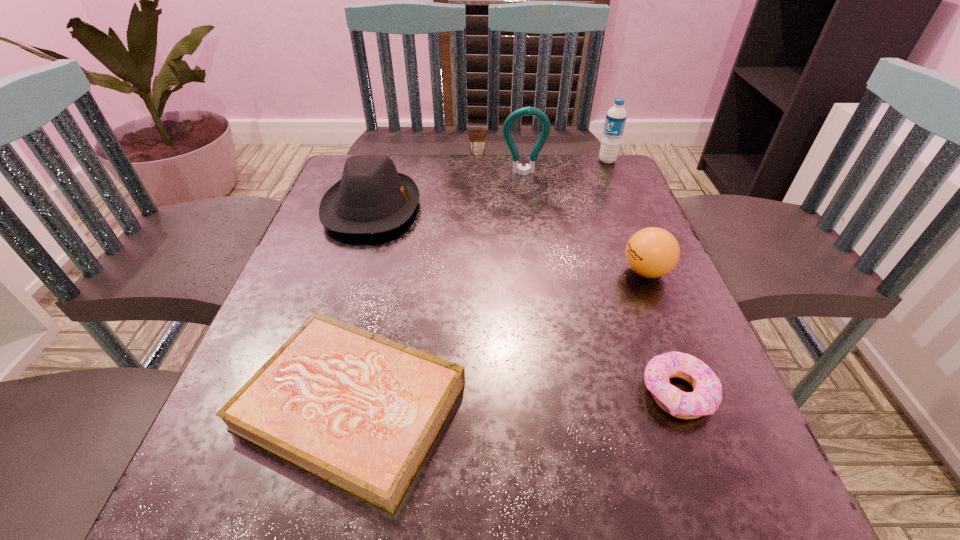
The height and width of the screenshot is (540, 960). I want to click on bottle opener, so click(517, 168).

Where is `the second farthest object`? The image size is (960, 540). the second farthest object is located at coordinates (517, 168).

At what (x,y) coordinates should I click in order to perform the action: click on the farthest object. Please return your answer as a coordinate pair (x, y). The width and height of the screenshot is (960, 540). Looking at the image, I should click on (616, 116).

The image size is (960, 540). I want to click on the third farthest object, so click(372, 197).

This screenshot has height=540, width=960. Identify the location of ping-pong ball. [652, 252].

Locate an element on the screen. hardback book is located at coordinates (359, 410).

This screenshot has width=960, height=540. Identify the location of doughnut. (x=707, y=391).

At what (x,y) coordinates should I click in order to perform the action: click on free space located at the jaws of the fifth nearest object. Please return your answer as a coordinate pair (x, y). This screenshot has height=540, width=960. Looking at the image, I should click on (538, 272).

Find the location of a particular element. This screenshot has width=960, height=540. vacant region located 0.390m on the label of the farthest object is located at coordinates (459, 160).

I want to click on vacant space located 0.370m on the label of the farthest object, so click(x=466, y=160).